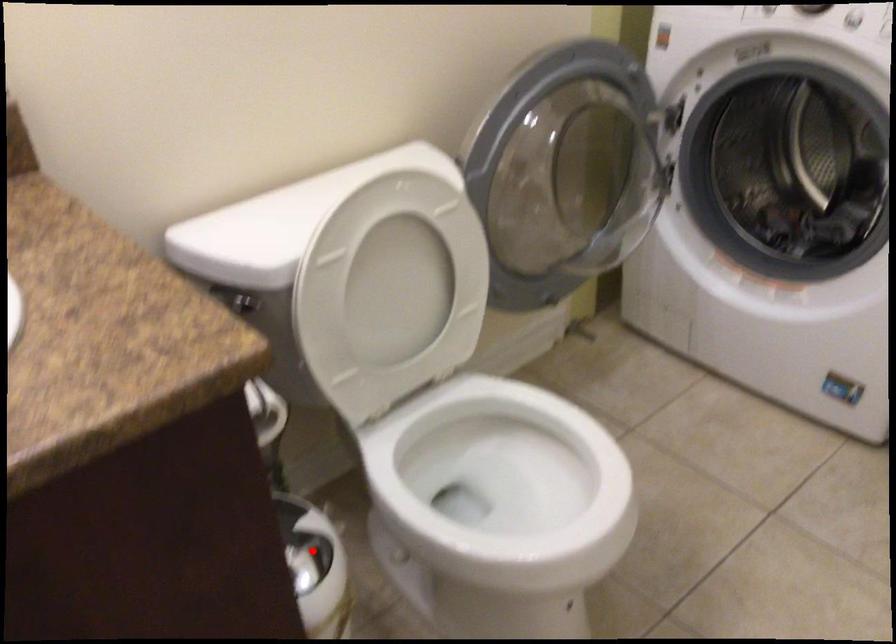
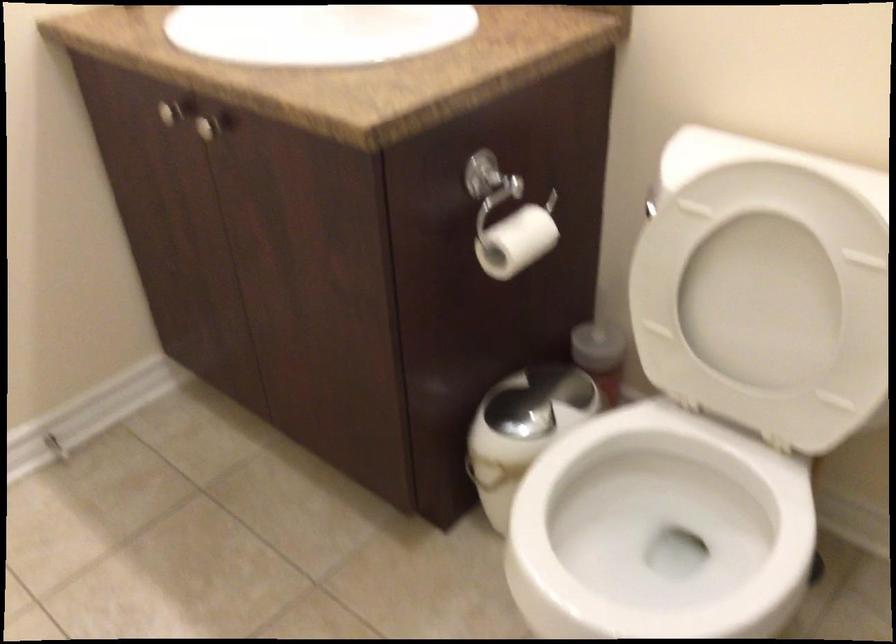
Question: I am providing you with two images of the same scene from different viewpoints. A red point is shown in image1. For the corresponding object point in image2, is it positioned nearer or farther from the camera?

Choices:
 (A) Nearer
 (B) Farther

Answer: (B)